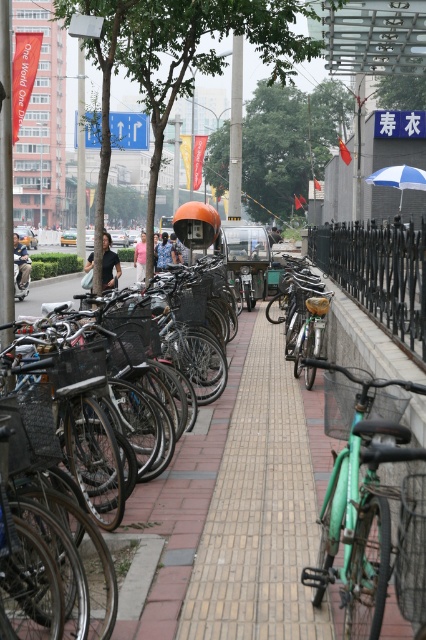
Question: Among these points, which one is nearest to the camera?

Choices:
 (A) (20, 276)
 (B) (414, 188)
 (C) (137, 256)

Answer: (B)

Question: Does metallic silver bicycle at center have a greater width compared to pink fabric shirt at center?

Choices:
 (A) no
 (B) yes

Answer: (A)

Question: Which point appears farthest from the camera in this image?

Choices:
 (A) (397, 308)
 (B) (423, 188)

Answer: (B)

Question: Is metallic silver bicycle at center below black wrought iron fence at right?

Choices:
 (A) no
 (B) yes

Answer: (B)

Question: Is metallic silver bicycle at center positioned behind black wrought iron fence at right?

Choices:
 (A) no
 (B) yes

Answer: (A)

Question: Estimate the real-world distances between objects in this image. Which object is closer to the blue printed shirt at center?

Choices:
 (A) green matte bicycle at center
 (B) black wrought iron fence at right

Answer: (B)